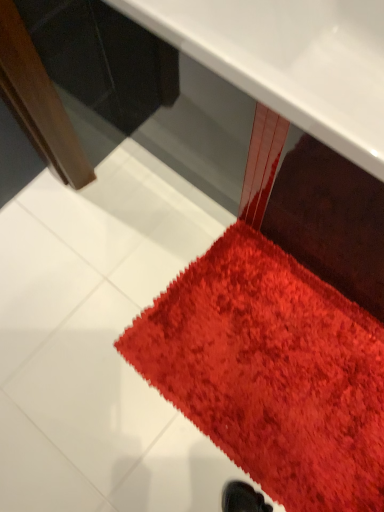
Where is `glossy plastic table at center`? The width and height of the screenshot is (384, 512). glossy plastic table at center is located at coordinates (290, 60).

The image size is (384, 512). Describe the element at coordinates (290, 60) in the screenshot. I see `glossy plastic table at center` at that location.

Image resolution: width=384 pixels, height=512 pixels. What do you see at coordinates (271, 372) in the screenshot? I see `shaggy red carpet at lower right` at bounding box center [271, 372].

Where is `shaggy red carpet at lower right`? shaggy red carpet at lower right is located at coordinates (271, 372).

The width and height of the screenshot is (384, 512). Find the location of `glossy plastic table at center`. glossy plastic table at center is located at coordinates (290, 60).

Does glossy plastic table at center appear on the left side of shaggy red carpet at lower right?

Incorrect, glossy plastic table at center is not on the left side of shaggy red carpet at lower right.

Is glossy plastic table at center closer to the viewer compared to shaggy red carpet at lower right?

Yes, it is.

Does point (134, 1) come farther from viewer compared to point (176, 297)?

No, it is in front of (176, 297).

From the image's perspective, between glossy plastic table at center and shaggy red carpet at lower right, who is located below?

shaggy red carpet at lower right, from the image's perspective.

From a real-world perspective, is glossy plastic table at center positioned above or below shaggy red carpet at lower right?

In terms of real-world spatial position, glossy plastic table at center is above shaggy red carpet at lower right.

Is glossy plastic table at center thinner than shaggy red carpet at lower right?

In fact, glossy plastic table at center might be wider than shaggy red carpet at lower right.

Is glossy plastic table at center shorter than shaggy red carpet at lower right?

In fact, glossy plastic table at center may be taller than shaggy red carpet at lower right.

Considering the relative sizes of glossy plastic table at center and shaggy red carpet at lower right in the image provided, is glossy plastic table at center bigger than shaggy red carpet at lower right?

Correct, glossy plastic table at center is larger in size than shaggy red carpet at lower right.

Is glossy plastic table at center located outside shaggy red carpet at lower right?

glossy plastic table at center lies outside shaggy red carpet at lower right's area.

Can you see glossy plastic table at center touching shaggy red carpet at lower right?

glossy plastic table at center is not next to shaggy red carpet at lower right, and they're not touching.

Is glossy plastic table at center oriented towards shaggy red carpet at lower right?

No, glossy plastic table at center is not aimed at shaggy red carpet at lower right.

What's the angular difference between glossy plastic table at center and shaggy red carpet at lower right's facing directions?

They differ by 1.68 degrees in their facing directions.

In the image, there is a glossy plastic table at center. Where is `mat below it (from the image's perspective)`? mat below it (from the image's perspective) is located at coordinates (271, 372).

Is shaggy red carpet at lower right at the left side of glossy plastic table at center?

Correct, you'll find shaggy red carpet at lower right to the left of glossy plastic table at center.

Is shaggy red carpet at lower right positioned before glossy plastic table at center?

That is False.

Does point (361, 483) appear closer or farther from the camera than point (121, 1)?

Point (361, 483).

From the image's perspective, who appears lower, shaggy red carpet at lower right or glossy plastic table at center?

shaggy red carpet at lower right appears lower in the image.

From a real-world perspective, between shaggy red carpet at lower right and glossy plastic table at center, who is vertically higher?

From a 3D spatial view, glossy plastic table at center is above.

Considering the relative sizes of shaggy red carpet at lower right and glossy plastic table at center in the image provided, is shaggy red carpet at lower right wider than glossy plastic table at center?

In fact, shaggy red carpet at lower right might be narrower than glossy plastic table at center.

Which of these two, shaggy red carpet at lower right or glossy plastic table at center, stands taller?

With more height is glossy plastic table at center.

In terms of size, does shaggy red carpet at lower right appear bigger or smaller than glossy plastic table at center?

shaggy red carpet at lower right is smaller than glossy plastic table at center.

Can we say shaggy red carpet at lower right lies outside glossy plastic table at center?

Absolutely, shaggy red carpet at lower right is external to glossy plastic table at center.

Is shaggy red carpet at lower right not close to glossy plastic table at center?

Actually, shaggy red carpet at lower right and glossy plastic table at center are a little close together.

Does shaggy red carpet at lower right turn towards glossy plastic table at center?

No, shaggy red carpet at lower right is not oriented towards glossy plastic table at center.

How many degrees apart are the facing directions of shaggy red carpet at lower right and glossy plastic table at center?

1.68 degrees.

How distant is shaggy red carpet at lower right from glossy plastic table at center?

shaggy red carpet at lower right and glossy plastic table at center are 23.95 inches apart.

At what (x,y) coordinates should I click in order to perform the action: click on table on the right of the shaggy red carpet at lower right. Please return your answer as a coordinate pair (x, y). This screenshot has width=384, height=512. Looking at the image, I should click on (290, 60).

Where is `mat behind the glossy plastic table at center`? mat behind the glossy plastic table at center is located at coordinates (271, 372).

I want to click on table in front of the shaggy red carpet at lower right, so click(x=290, y=60).